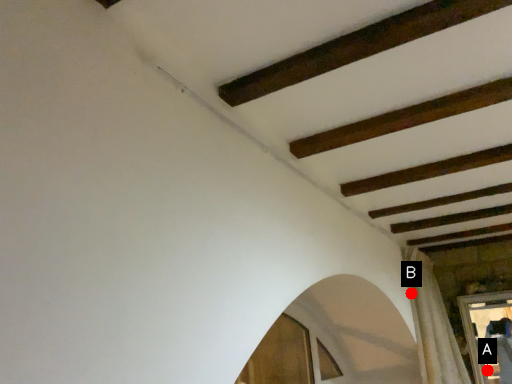
Question: Two points are circled on the image, labeled by A and B beside each circle. Which of the following is the closest to the observer?

Choices:
 (A) A is closer
 (B) B is closer

Answer: (B)